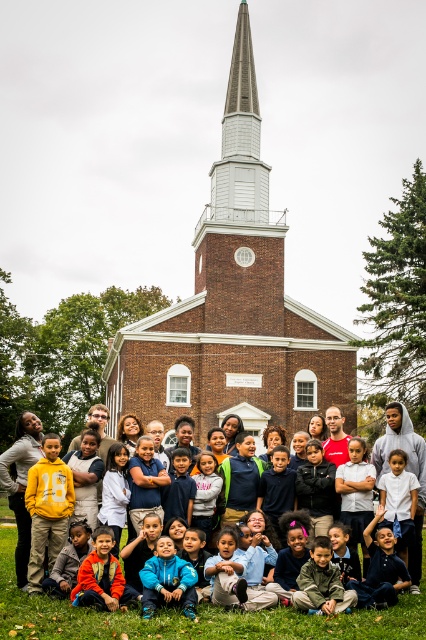
You are a photographer trying to capture a wide shot of the scene. You notice the brown brick chapel at center and the matte yellow hoodie at center. Which object is wider, and how does this affect your composition?

The matte yellow hoodie at center is wider than the brown brick chapel at center. This means you should position your camera to ensure the wider matte yellow hoodie at center is fully captured in the frame while adjusting the angle to include the chapel, which is narrower.

You are a photographer trying to capture a photo of the matte yellow hoodie at center without including the brown brick chapel at center in the frame. Based on their positions, is this possible?

The brown brick chapel at center is positioned over the matte yellow hoodie at center, so it would block the view. Therefore, it is not possible to capture the matte yellow hoodie at center without including the brown brick chapel at center in the frame.